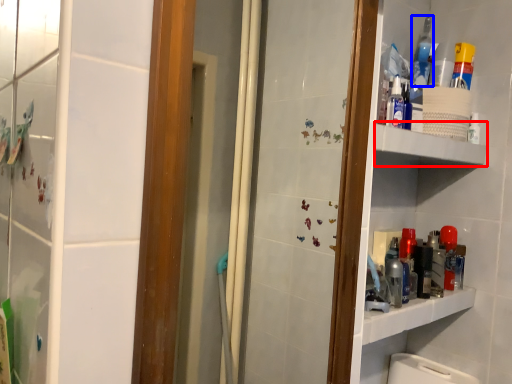
Question: Which point is closer to the camera, shelve (highlighted by a red box) or mouthwash (highlighted by a blue box)?

Choices:
 (A) shelve
 (B) mouthwash

Answer: (A)